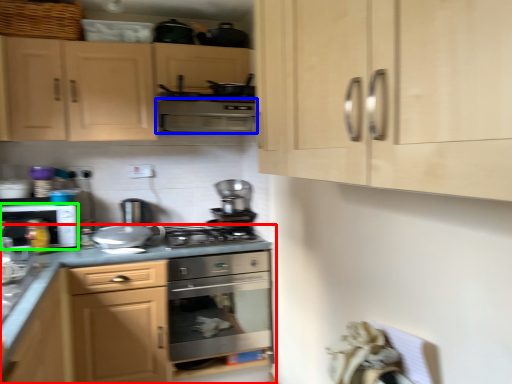
Question: Which object is the closest to the cabinetry (highlighted by a red box)? Choose among these: vent (highlighted by a blue box) or kitchen appliance (highlighted by a green box).

Choices:
 (A) vent
 (B) kitchen appliance

Answer: (B)